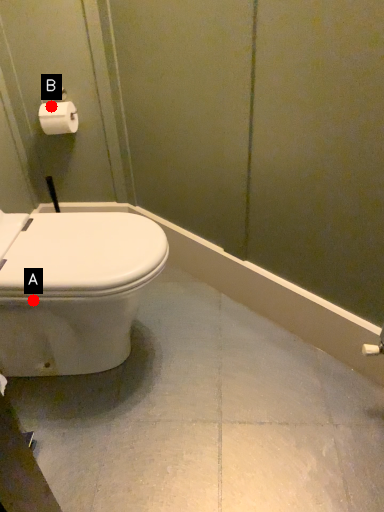
Question: Two points are circled on the image, labeled by A and B beside each circle. Which of the following is the closest to the observer?

Choices:
 (A) A is closer
 (B) B is closer

Answer: (A)